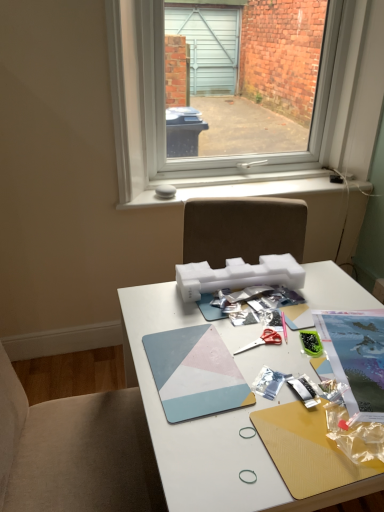
Where is `free point behind green plastic container at center-right`? This screenshot has height=512, width=384. free point behind green plastic container at center-right is located at coordinates (301, 307).